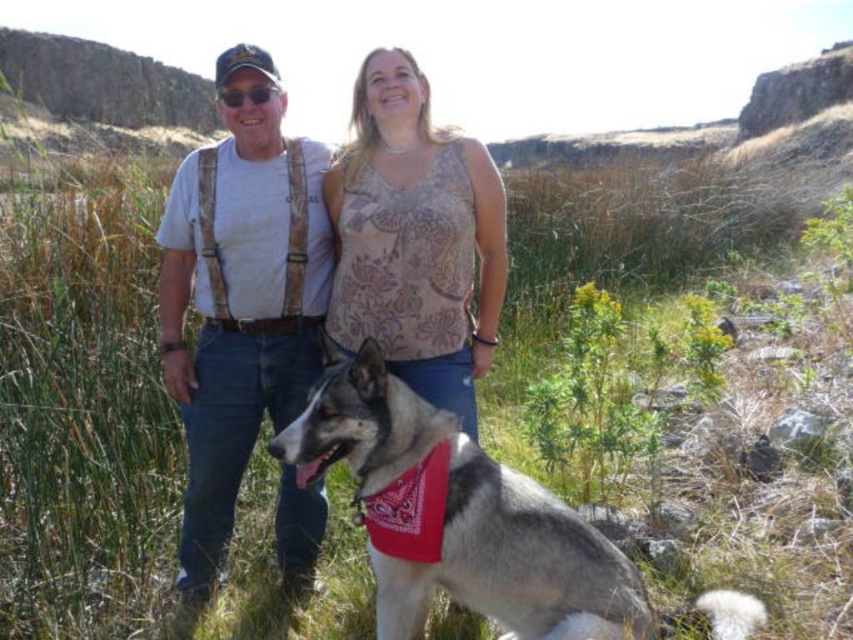
Which is below, light gray t-shirt at center or gray fur dog at center?

gray fur dog at center is below.

Is light gray t-shirt at center wider than gray fur dog at center?

In fact, light gray t-shirt at center might be narrower than gray fur dog at center.

Measure the distance between light gray t-shirt at center and camera.

light gray t-shirt at center and camera are 3.55 meters apart from each other.

I want to click on light gray t-shirt at center, so click(239, 308).

Does floral-patterned tank top at center have a larger size compared to matte black goggles at upper center?

Correct, floral-patterned tank top at center is larger in size than matte black goggles at upper center.

Is floral-patterned tank top at center shorter than matte black goggles at upper center?

No.

Who is more forward, (373, 321) or (260, 88)?

Point (373, 321) is in front.

Find the location of a particular element. The width and height of the screenshot is (853, 640). floral-patterned tank top at center is located at coordinates (416, 237).

Is gray fur dog at center further to the viewer compared to matte black goggles at upper center?

No, it is in front of matte black goggles at upper center.

Who is lower down, gray fur dog at center or matte black goggles at upper center?

gray fur dog at center is lower down.

Locate an element on the screen. The image size is (853, 640). gray fur dog at center is located at coordinates (457, 516).